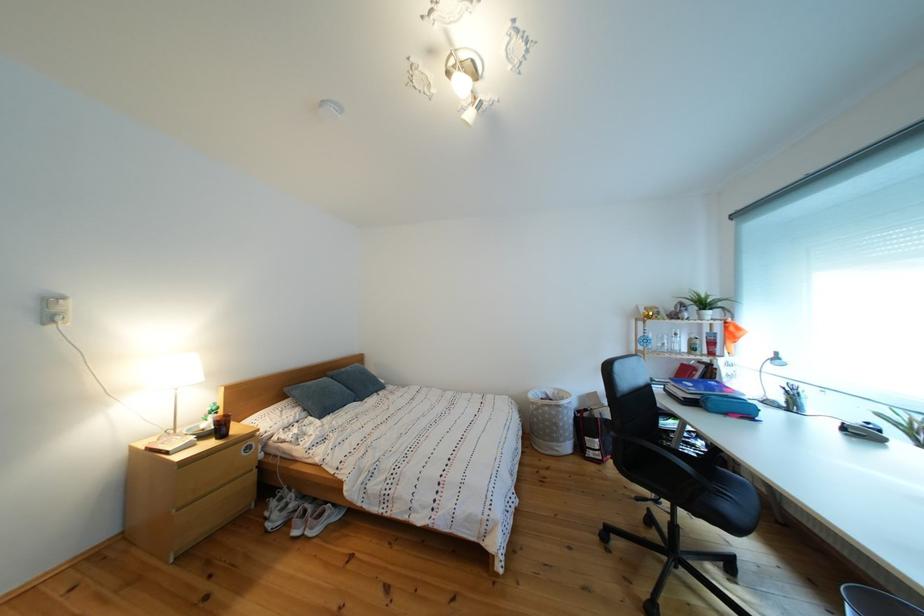
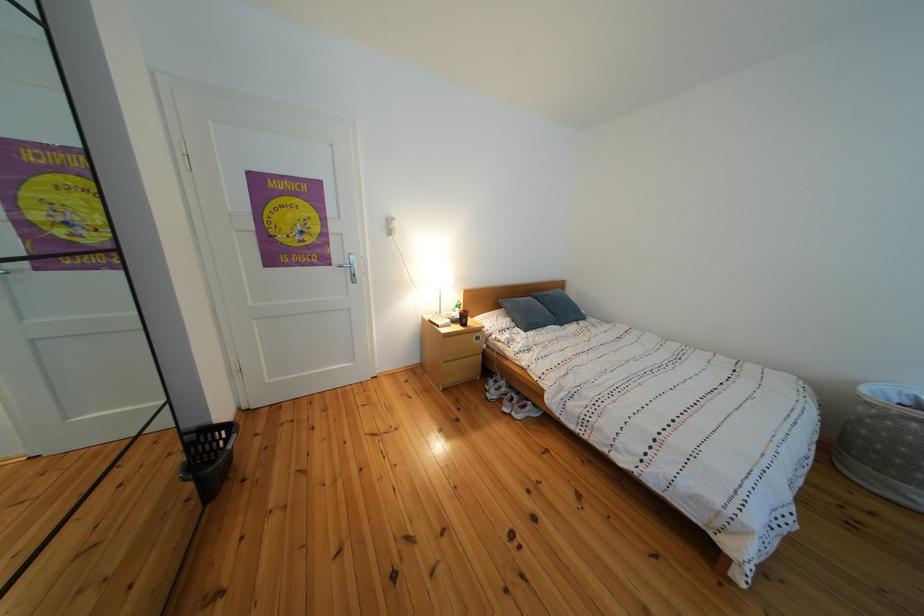
How did the camera likely rotate?

The rotation direction of the camera is left-down.